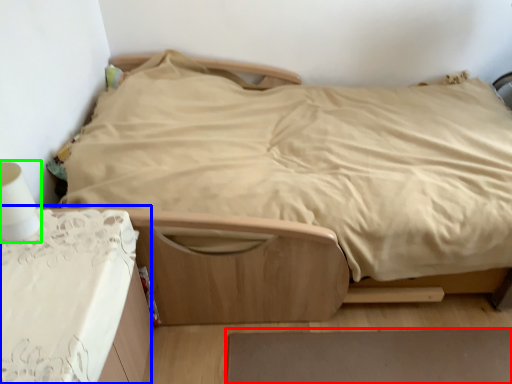
Question: Considering the real-world distances, which object is closest to plain (highlighted by a red box)? table (highlighted by a blue box) or table lamp (highlighted by a green box).

Choices:
 (A) table
 (B) table lamp

Answer: (A)